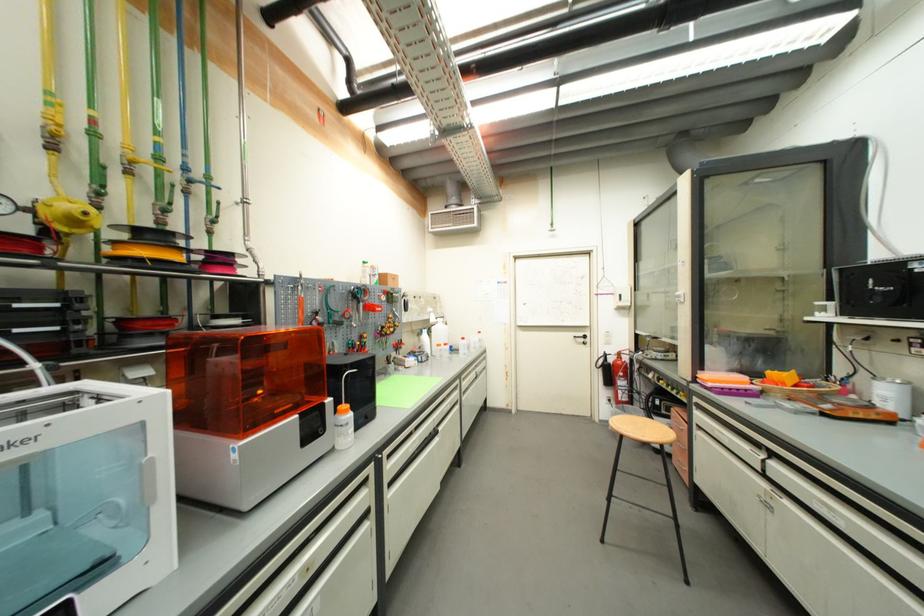
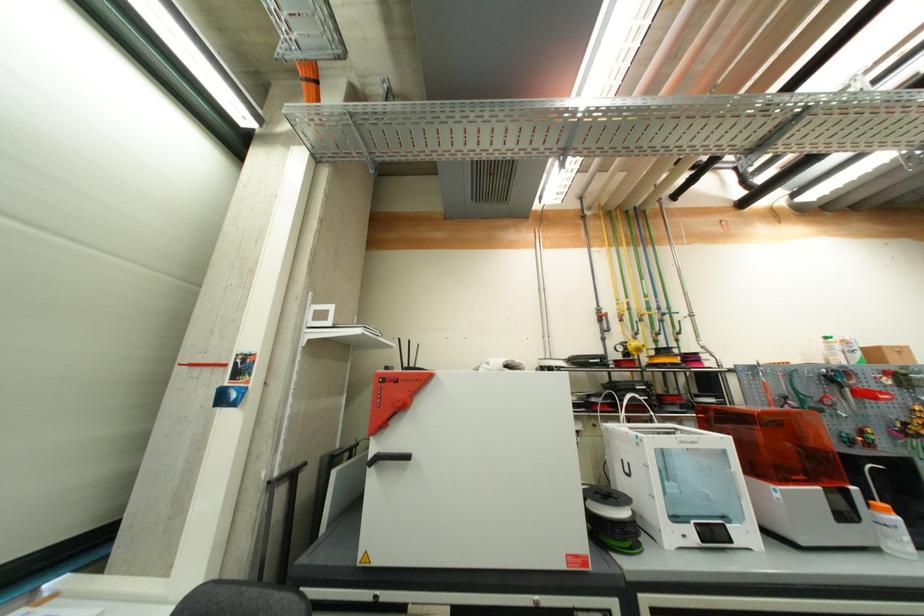
The images are taken continuously from a first-person perspective. In which direction is your viewpoint rotating?

The camera rotated toward left-up.